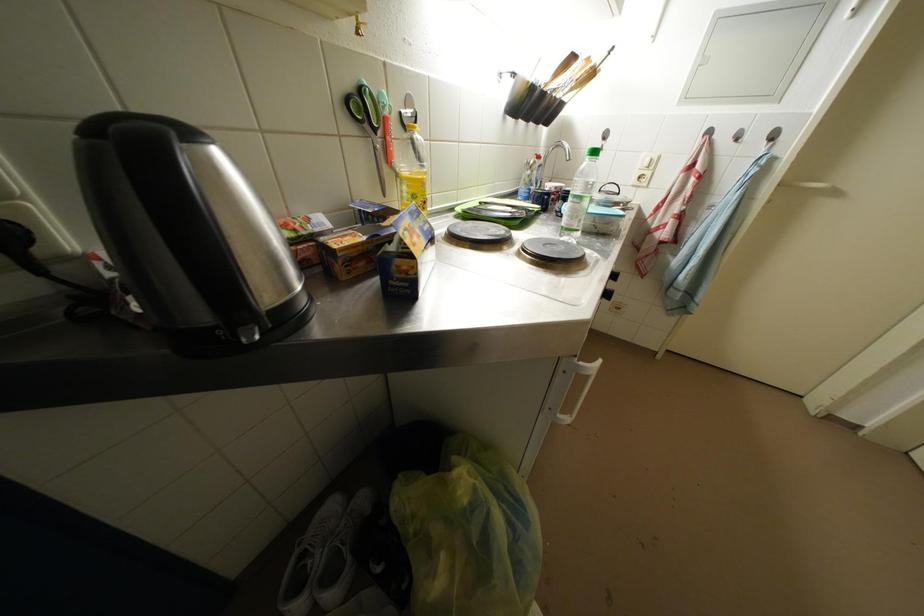
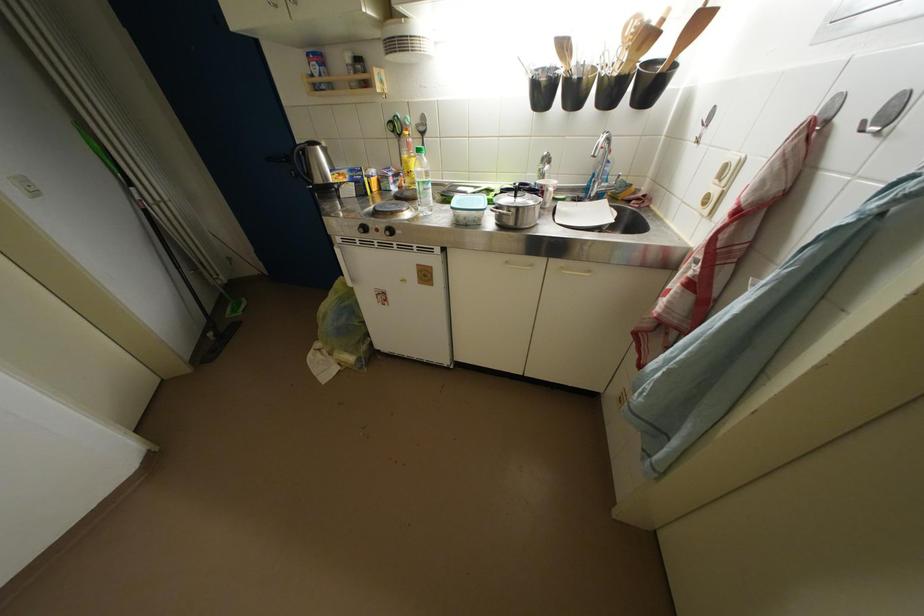
Where in the second image is the point corresponding to [430,188] from the first image?

(412, 167)